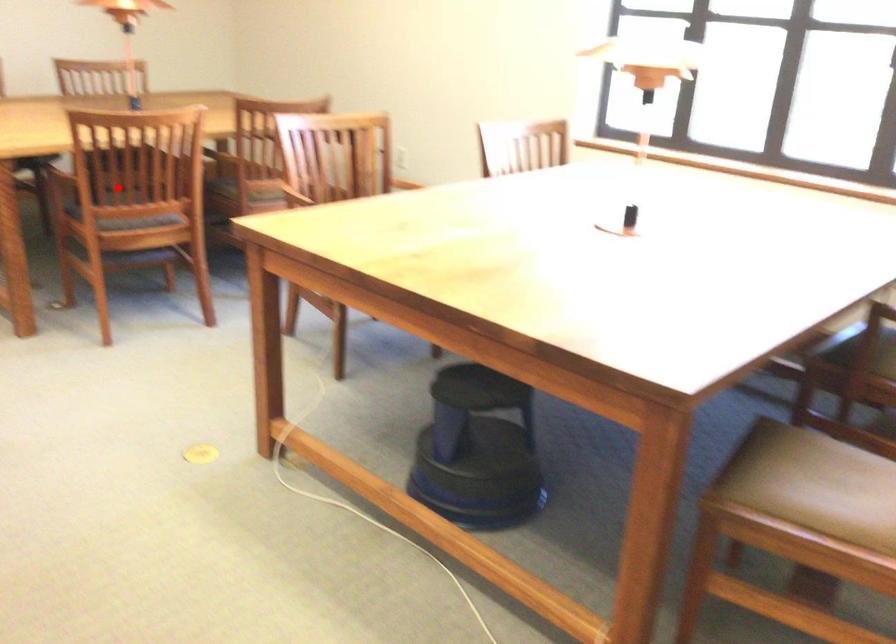
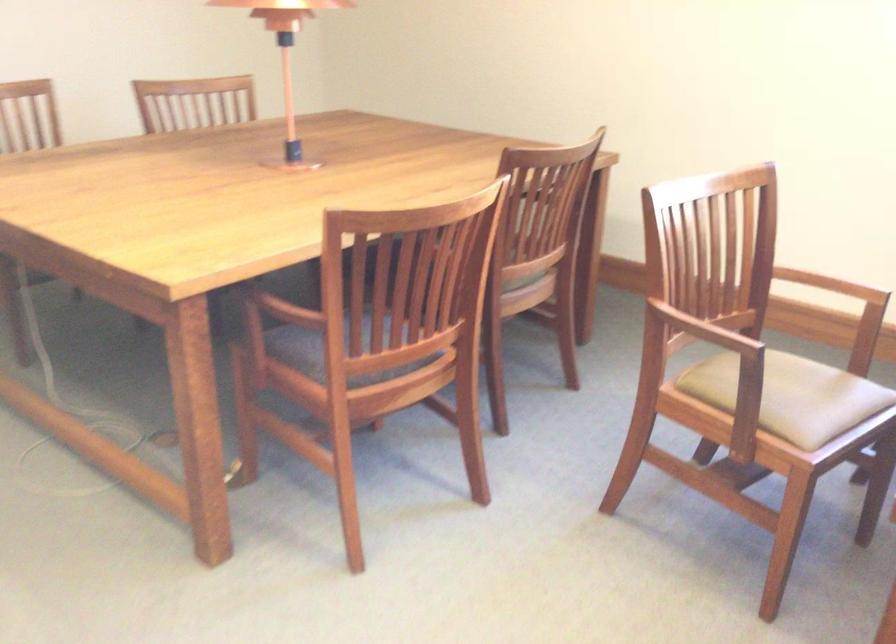
Where in the second image is the point corresponding to the highlighted location from the first image?

(366, 330)